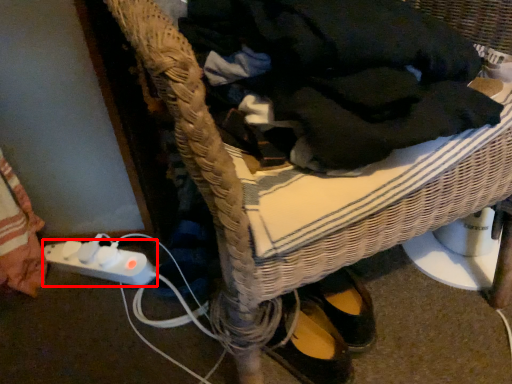
Question: Observing the image, what is the correct spatial positioning of plug (annotated by the red box) in reference to clothing?

Choices:
 (A) right
 (B) left

Answer: (B)